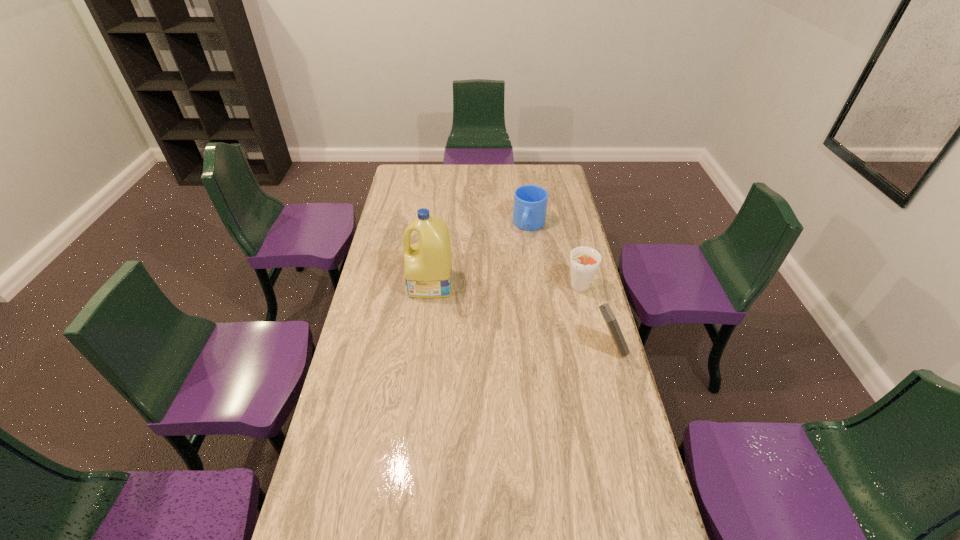
Find the location of a particular element. free location located on the side of the second object from left to right with the handle is located at coordinates (517, 268).

Locate an element on the screen. Image resolution: width=960 pixels, height=540 pixels. blank area located 0.240m on the side of the second object from left to right with the handle is located at coordinates (516, 273).

What are the coordinates of `vacant space located 0.120m on the side of the second object from left to right with the handle` in the screenshot? It's located at (521, 255).

The image size is (960, 540). I want to click on object positioned at the left edge, so click(x=428, y=264).

Locate an element on the screen. calculator present at the right edge is located at coordinates (610, 319).

At what (x,y) coordinates should I click in order to perform the action: click on root beer that is positioned at the right edge. Please return your answer as a coordinate pair (x, y). The image size is (960, 540). Looking at the image, I should click on (584, 261).

You are a GUI agent. You are given a task and a screenshot of the screen. Output one action in this format:
    pyautogui.click(x=<x>, y=<y>)
    Task: Click on the mug present at the right edge
    
    Given the screenshot: What is the action you would take?
    pyautogui.click(x=530, y=201)

The image size is (960, 540). In order to click on vacant space at the far edge of the desktop in this screenshot , I will do `click(426, 185)`.

Find the location of a particular element. The width and height of the screenshot is (960, 540). vacant space at the near edge of the desktop is located at coordinates (534, 533).

The height and width of the screenshot is (540, 960). In the image, there is a desktop. In order to click on vacant space at the left edge in this screenshot , I will do `click(417, 193)`.